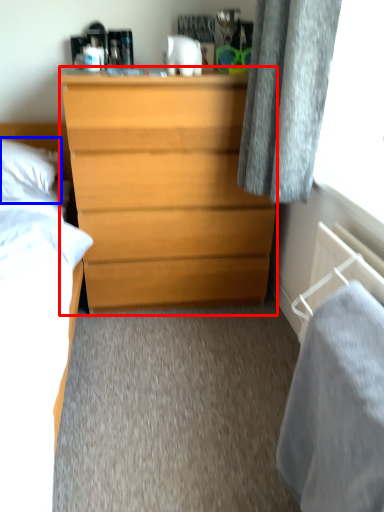
Question: Which point is further to the camera, chest of drawers (highlighted by a red box) or pillow (highlighted by a blue box)?

Choices:
 (A) chest of drawers
 (B) pillow

Answer: (B)